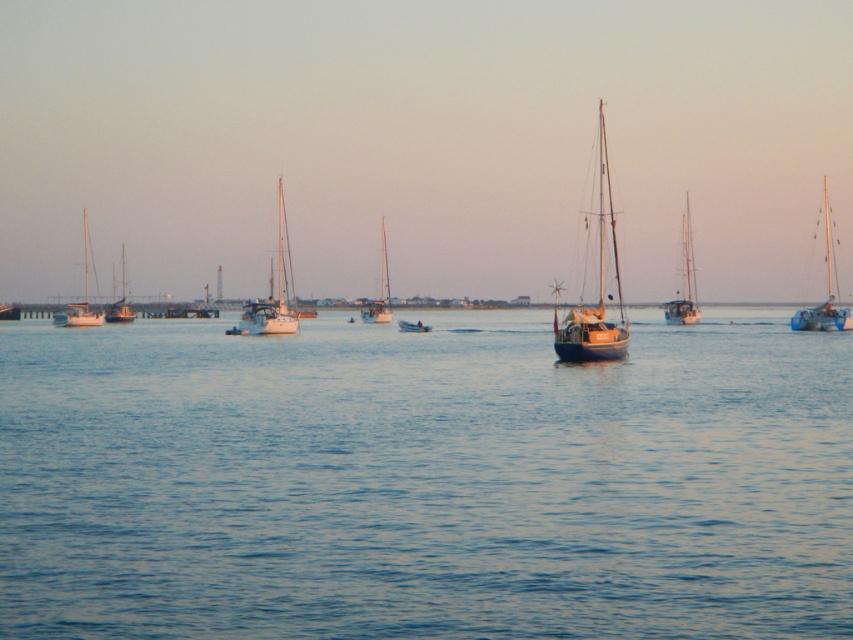
You are a sailor planning to dock your boat at a pier located between the blue wooden sailboat at right and the white matte sailboat at left. The pier is 50 meters long. Can your boat fit between them without overlapping either boat?

The distance between the blue wooden sailboat at right and the white matte sailboat at left is 80.06 meters, which is greater than the 50 meters length of the pier. Therefore, the pier can fit between them without overlapping either boat.

Based on the photo, you are a photographer trying to capture the wooden sailboat at center in your shot. You notice the blue water at center is also in the frame. Based on their sizes in the image, which object would appear smaller?

The blue water at center appears smaller than the wooden sailboat at center because the blue water at center is shorter than wooden sailboat at center.

You are standing at the center of the image and want to move towards the point labeled as point (424,481). Which direction should you go to reach it?

The point (424,481) corresponds to blue water at center, so you are already at the correct location.